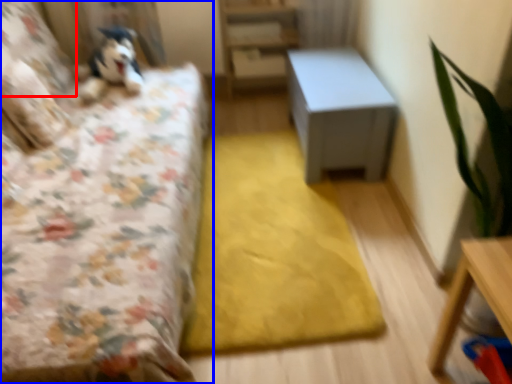
Question: Which of the following is the farthest to the observer, pillow (highlighted by a red box) or bed (highlighted by a blue box)?

Choices:
 (A) pillow
 (B) bed

Answer: (A)